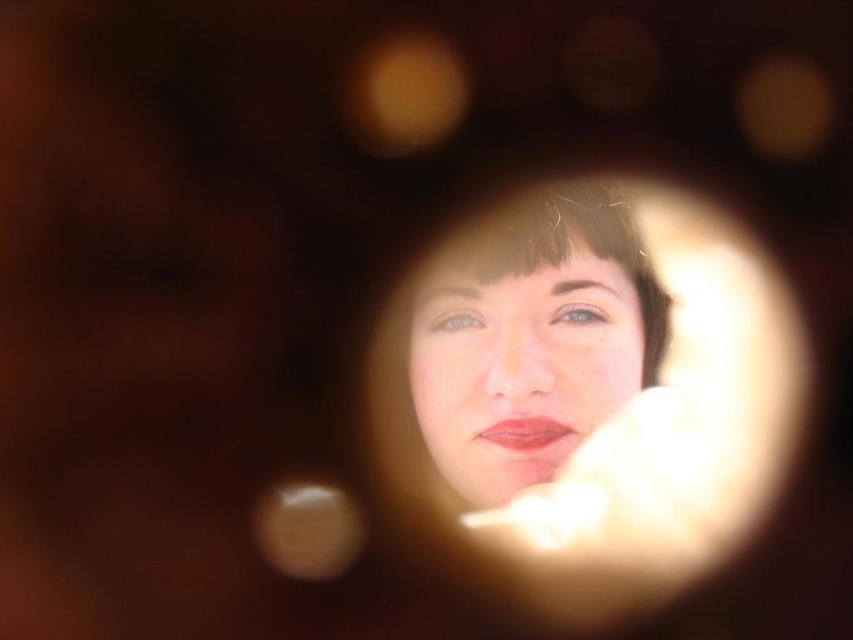
Question: Does smooth skin face at center appear on the right side of matte red lipstick at center?

Choices:
 (A) no
 (B) yes

Answer: (B)

Question: Does smooth skin face at center come in front of matte red lipstick at center?

Choices:
 (A) no
 (B) yes

Answer: (B)

Question: Is smooth skin face at center smaller than matte red lipstick at center?

Choices:
 (A) no
 (B) yes

Answer: (A)